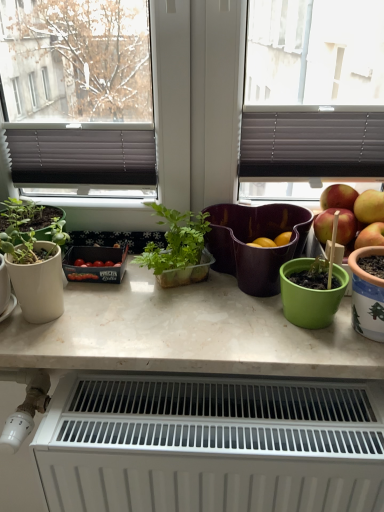
Find the location of `free space in front of matte purple flowerpot at center, arranged as the first flowerpot when viewed from the back`. free space in front of matte purple flowerpot at center, arranged as the first flowerpot when viewed from the back is located at coordinates (238, 336).